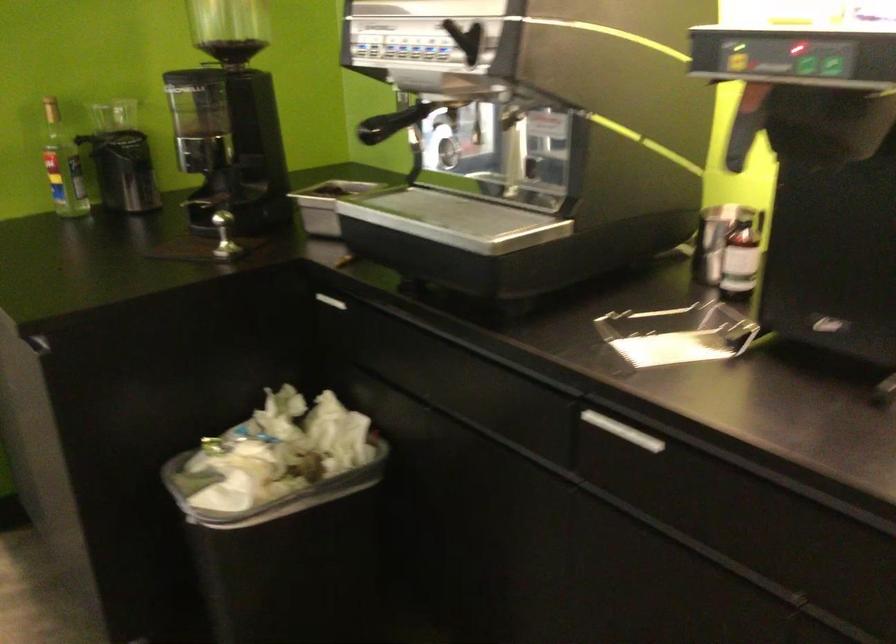
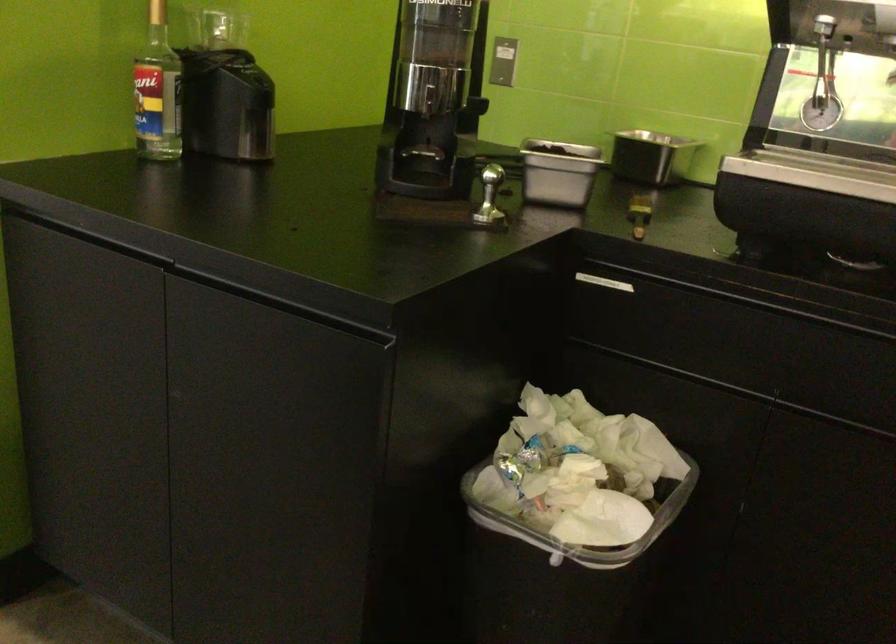
In the second image, find the point that corresponds to [222,489] in the first image.

(581, 524)